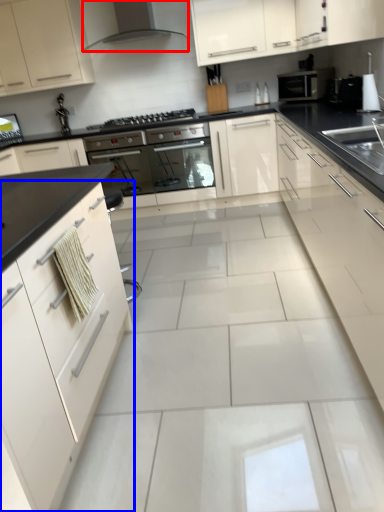
Question: Among these objects, which one is nearest to the camera, home appliance (highlighted by a red box) or cabinetry (highlighted by a blue box)?

Choices:
 (A) home appliance
 (B) cabinetry

Answer: (B)